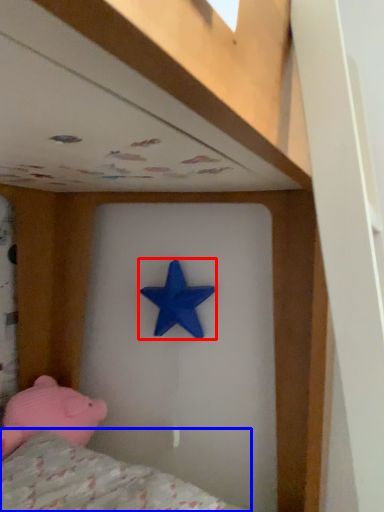
Question: Among these objects, which one is farthest to the camera, starfish (highlighted by a red box) or mattress (highlighted by a blue box)?

Choices:
 (A) starfish
 (B) mattress

Answer: (A)